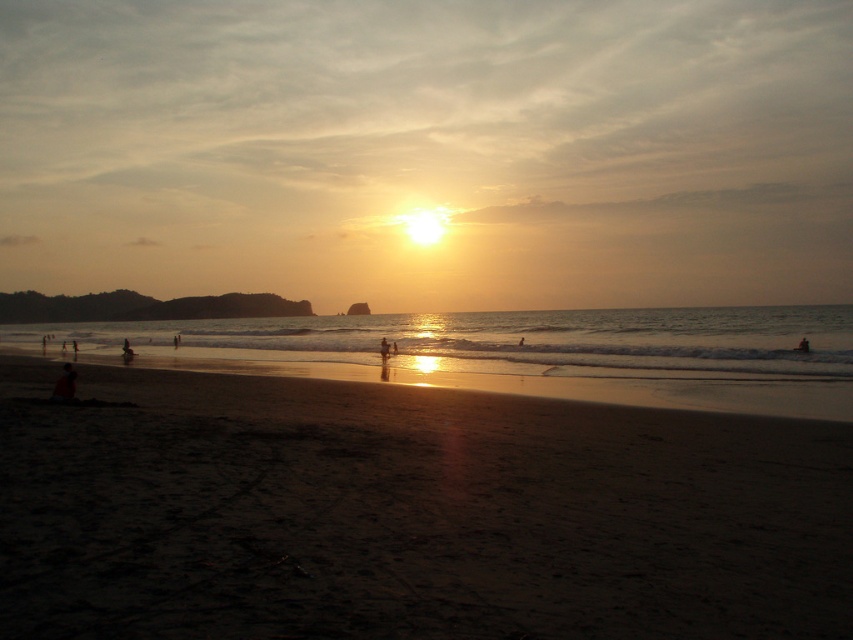
Question: Is matte black person at lower left positioned in front of silhouette human at lower right?

Choices:
 (A) no
 (B) yes

Answer: (B)

Question: Is shiny metallic water at center thinner than matte black person at lower left?

Choices:
 (A) no
 (B) yes

Answer: (A)

Question: Is silhouette human at lower right further to camera compared to dark skin human at center?

Choices:
 (A) yes
 (B) no

Answer: (B)

Question: Which point is farther from the camera taking this photo?

Choices:
 (A) (387, 344)
 (B) (801, 344)
 (C) (613, 340)

Answer: (C)

Question: Among these points, which one is nearest to the camera?

Choices:
 (A) (55, 388)
 (B) (387, 332)
 (C) (9, 554)
 (D) (807, 344)

Answer: (C)

Question: Which of the following is the farthest from the observer?

Choices:
 (A) (323, 605)
 (B) (802, 349)

Answer: (B)